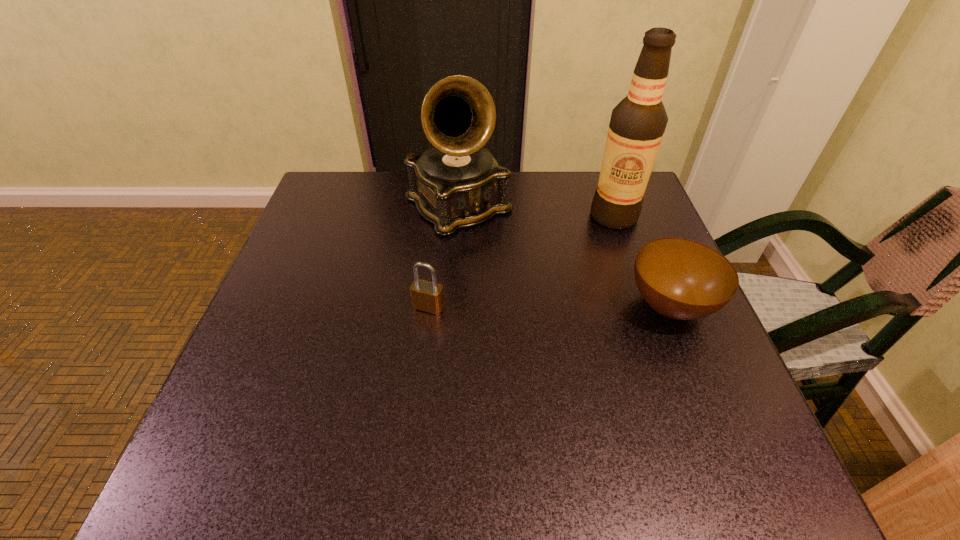
Identify the location of vacant area at the right edge of the desktop. (700, 366).

The image size is (960, 540). In order to click on blank space at the far left corner of the desktop in this screenshot , I will do `click(314, 214)`.

Where is `empty space between the shortest object and the padlock`? The image size is (960, 540). empty space between the shortest object and the padlock is located at coordinates (549, 306).

The image size is (960, 540). I want to click on free space that is in between the padlock and the second tallest object, so click(444, 256).

Find the location of a particular element. blank region between the padlock and the shortest object is located at coordinates (549, 306).

Find the location of a particular element. vacant area between the shortest object and the padlock is located at coordinates (549, 306).

Identify the location of empty location between the phonograph record and the alcohol. (536, 211).

This screenshot has height=540, width=960. I want to click on vacant space in between the third shortest object and the padlock, so click(444, 256).

Identify the location of free space between the phonograph record and the alcohol. (536, 211).

This screenshot has height=540, width=960. Identify the location of unoccupied area between the third shortest object and the padlock. (444, 256).